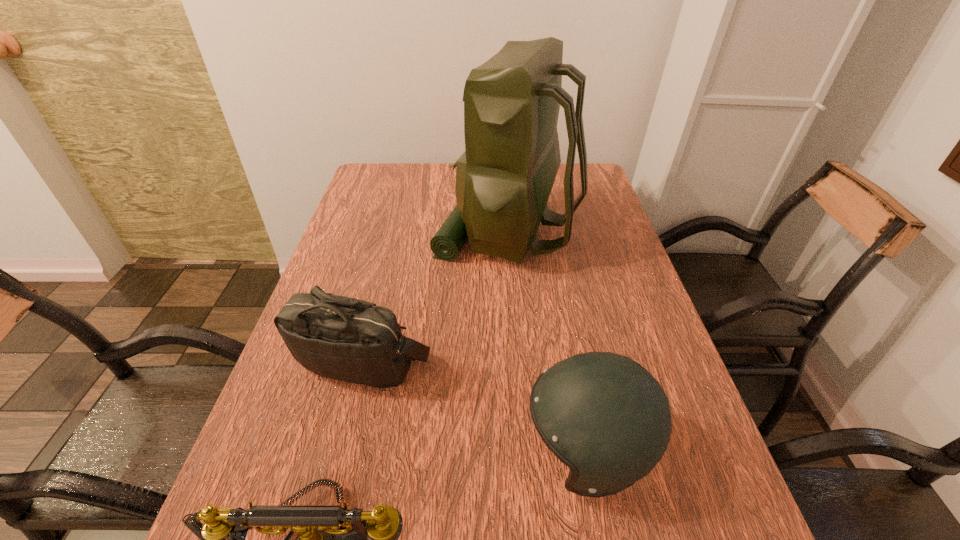
I want to click on vacant position in the image that satisfies the following two spatial constraints: 1. on the front of the tallest object with visible pockets; 2. at the front padded panel of the second farthest object, so click(518, 362).